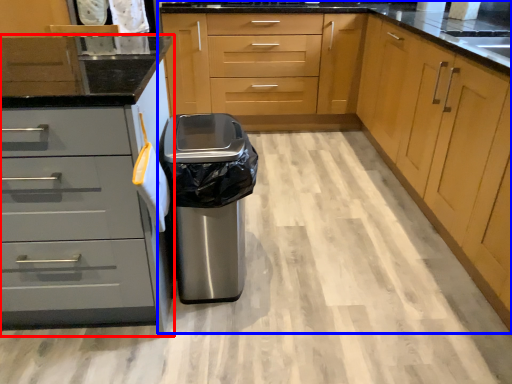
Question: Among these objects, which one is nearest to the camera, cabinetry (highlighted by a red box) or cabinetry (highlighted by a blue box)?

Choices:
 (A) cabinetry
 (B) cabinetry

Answer: (B)